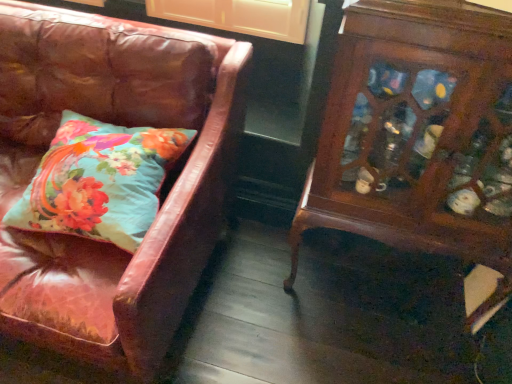
Question: Should I look upward or downward to see wooden cabinet at right?

Choices:
 (A) down
 (B) up

Answer: (B)

Question: Considering the relative sizes of wooden cabinet at right and teal floral pillow at left in the image provided, is wooden cabinet at right thinner than teal floral pillow at left?

Choices:
 (A) yes
 (B) no

Answer: (A)

Question: Considering the relative sizes of wooden cabinet at right and teal floral pillow at left in the image provided, is wooden cabinet at right wider than teal floral pillow at left?

Choices:
 (A) yes
 (B) no

Answer: (B)

Question: Is there a large distance between wooden cabinet at right and teal floral pillow at left?

Choices:
 (A) no
 (B) yes

Answer: (A)

Question: Is wooden cabinet at right oriented towards teal floral pillow at left?

Choices:
 (A) no
 (B) yes

Answer: (A)

Question: From a real-world perspective, is wooden cabinet at right on teal floral pillow at left?

Choices:
 (A) no
 (B) yes

Answer: (A)

Question: Considering the relative positions of wooden cabinet at right and teal floral pillow at left in the image provided, is wooden cabinet at right to the right of teal floral pillow at left from the viewer's perspective?

Choices:
 (A) no
 (B) yes

Answer: (B)

Question: Is the depth of leather couch at left greater than that of wooden cabinet at right?

Choices:
 (A) yes
 (B) no

Answer: (B)

Question: Considering the relative sizes of leather couch at left and wooden cabinet at right in the image provided, is leather couch at left wider than wooden cabinet at right?

Choices:
 (A) yes
 (B) no

Answer: (A)

Question: Is leather couch at left far away from wooden cabinet at right?

Choices:
 (A) yes
 (B) no

Answer: (B)

Question: From the image's perspective, would you say leather couch at left is shown under wooden cabinet at right?

Choices:
 (A) no
 (B) yes

Answer: (A)

Question: From the image's perspective, is leather couch at left over wooden cabinet at right?

Choices:
 (A) no
 (B) yes

Answer: (B)

Question: Is leather couch at left shorter than wooden cabinet at right?

Choices:
 (A) no
 (B) yes

Answer: (B)

Question: Considering the relative sizes of wooden cabinet at right and leather couch at left in the image provided, is wooden cabinet at right thinner than leather couch at left?

Choices:
 (A) yes
 (B) no

Answer: (A)